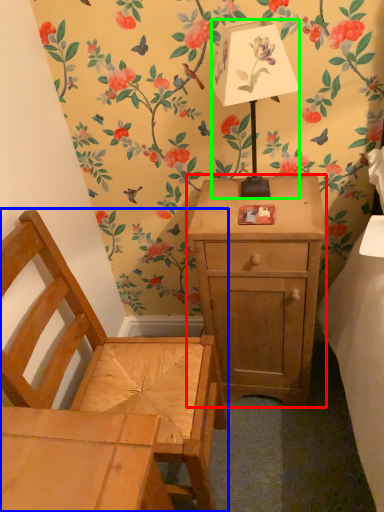
Question: Which object is the farthest from nightstand (highlighted by a red box)? Choose among these: chair (highlighted by a blue box) or table lamp (highlighted by a green box).

Choices:
 (A) chair
 (B) table lamp

Answer: (B)